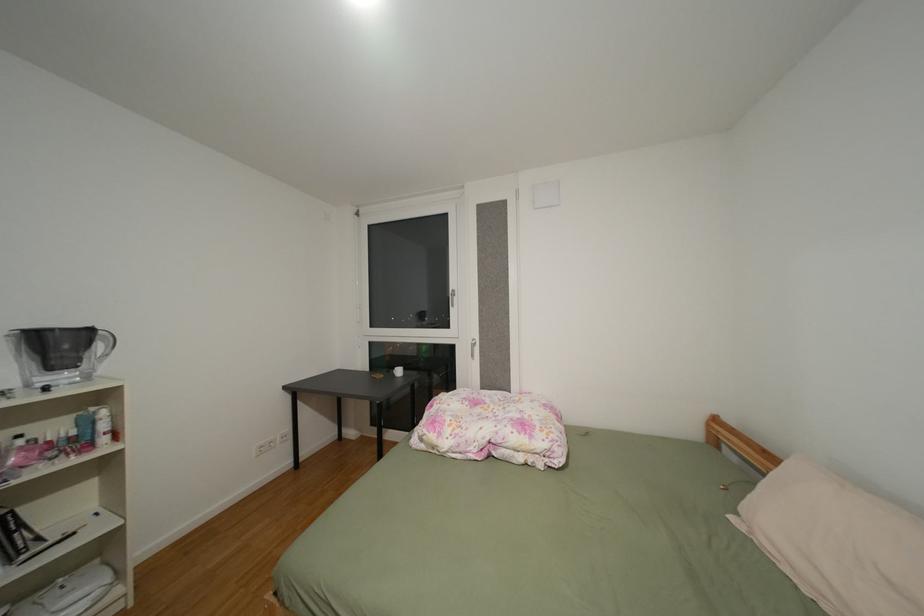
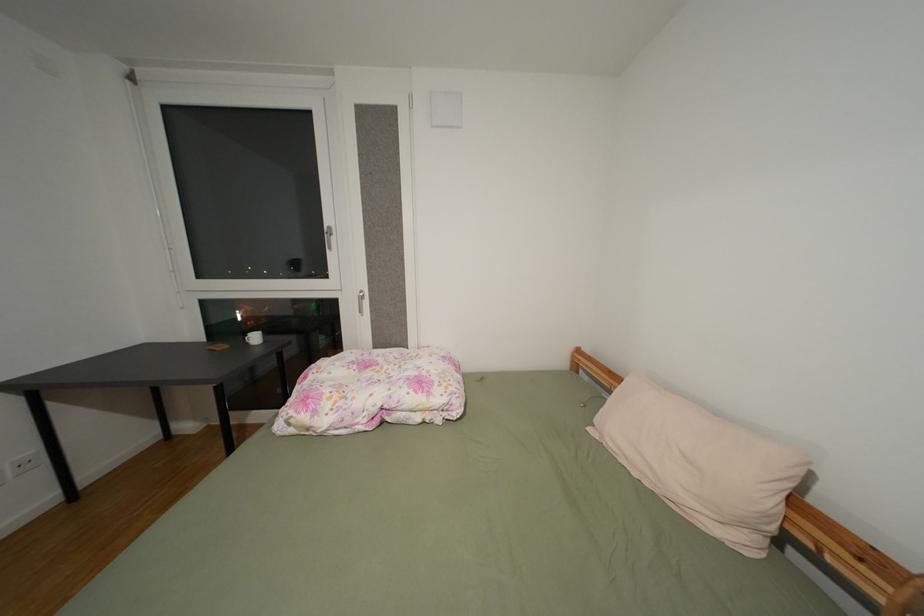
Question: The camera is either moving clockwise (left) or counter-clockwise (right) around the object. The first image is from the beginning of the video and the second image is from the end. Is the camera moving left or right when shooting the video?

Choices:
 (A) Left
 (B) Right

Answer: (A)